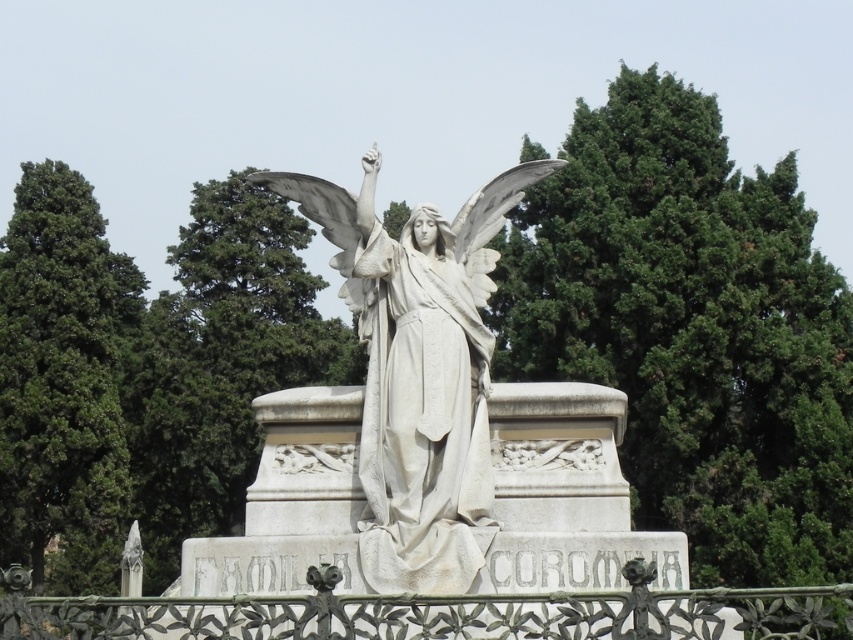
Question: Is white marble statue at center bigger than green leafy tree at left?

Choices:
 (A) yes
 (B) no

Answer: (B)

Question: Which of the following is the closest to the observer?

Choices:
 (A) white marble statue at center
 (B) wrought iron fence at lower center
 (C) green leafy tree at left

Answer: (B)

Question: Is green leafy tree at upper center below wrought iron fence at lower center?

Choices:
 (A) yes
 (B) no

Answer: (B)

Question: Which object is the farthest from the wrought iron fence at lower center?

Choices:
 (A) white marble statue at center
 (B) green leafy tree at upper center
 (C) green leafy tree at left

Answer: (C)

Question: Does green leafy tree at left appear on the right side of wrought iron fence at lower center?

Choices:
 (A) yes
 (B) no

Answer: (B)

Question: Which of the following is the closest to the observer?

Choices:
 (A) wrought iron fence at lower center
 (B) green leafy tree at left
 (C) white marble statue at center

Answer: (A)